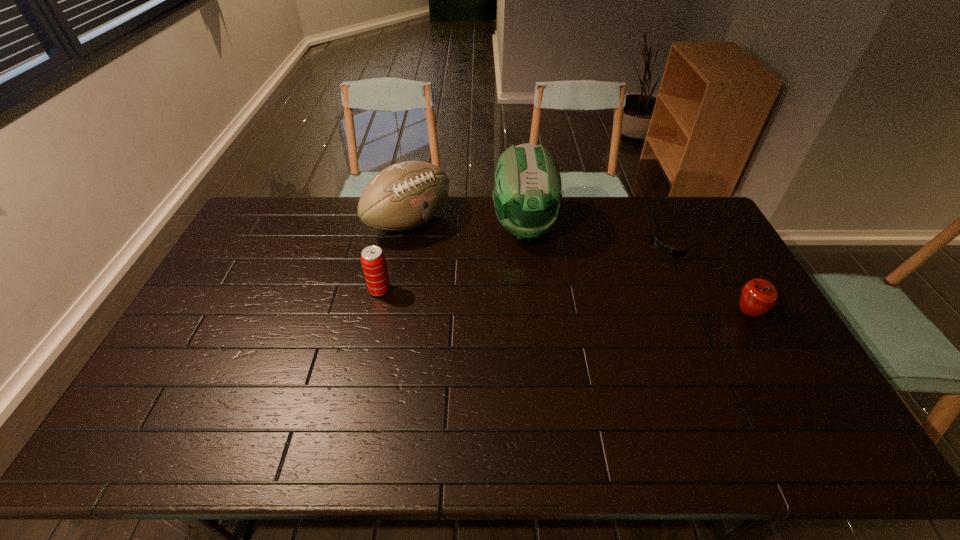
Choose which object is the fourth nearest neighbor to the third object from left to right. Please provide its 2D coordinates. Your answer should be formatted as a tuple, i.e. [(x, y)], where the tuple contains the x and y coordinates of a point satisfying the conditions above.

[(758, 296)]

Locate an element on the screen. vacant position in the image that satisfies the following two spatial constraints: 1. on the back side of the third object from left to right; 2. on the right side of the fourth farthest object is located at coordinates (394, 227).